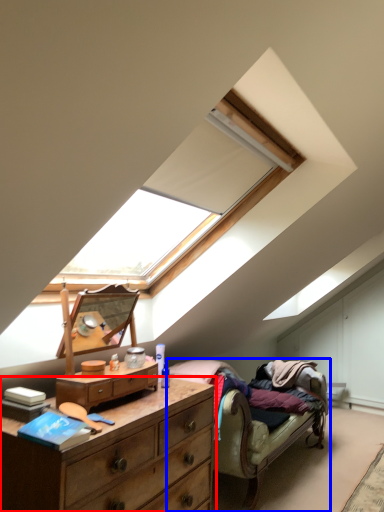
Question: Which point is further to the camera, chest of drawers (highlighted by a red box) or studio couch (highlighted by a blue box)?

Choices:
 (A) chest of drawers
 (B) studio couch

Answer: (B)